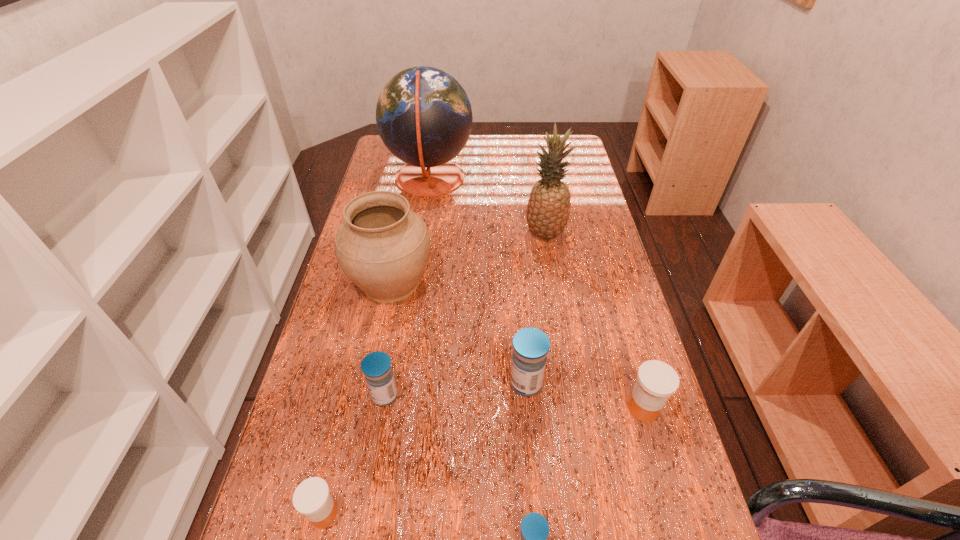
Find the location of a particular element. the farthest object is located at coordinates (424, 117).

At what (x,y) coordinates should I click in order to perform the action: click on pineapple. Please return your answer as a coordinate pair (x, y). Looking at the image, I should click on (548, 209).

This screenshot has width=960, height=540. I want to click on the sixth shortest object, so click(x=383, y=247).

Image resolution: width=960 pixels, height=540 pixels. I want to click on urn, so click(x=383, y=247).

Where is `the biggest blue medicine`? This screenshot has width=960, height=540. the biggest blue medicine is located at coordinates (530, 345).

Identify the location of the tallest medicine. (530, 345).

Find the location of a particular element. The width and height of the screenshot is (960, 540). the second smallest blue medicine is located at coordinates (376, 366).

Locate an element on the screen. the leftmost blue medicine is located at coordinates (376, 366).

This screenshot has width=960, height=540. I want to click on the right orange medicine, so click(656, 381).

Find the location of a particular element. The width and height of the screenshot is (960, 540). the rightmost medicine is located at coordinates (656, 381).